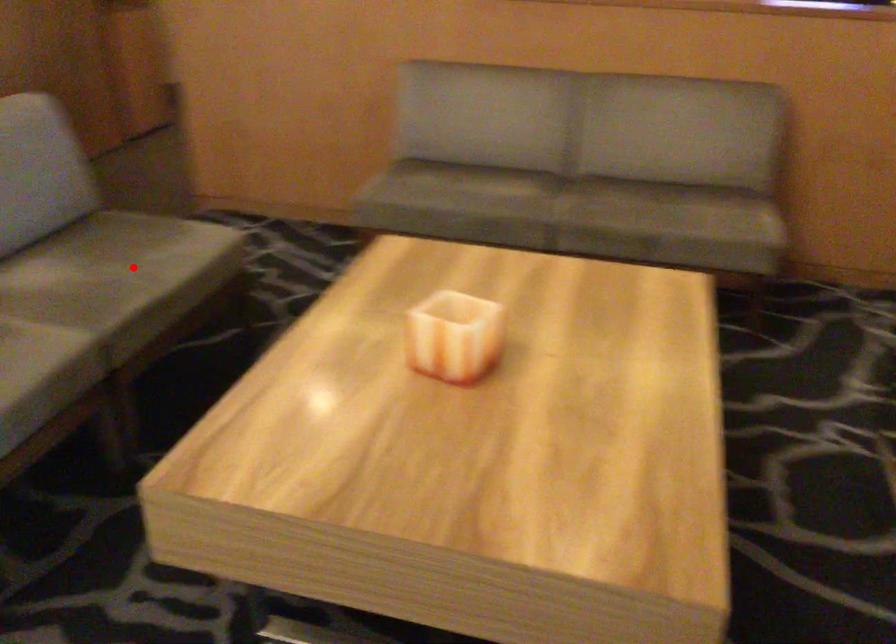
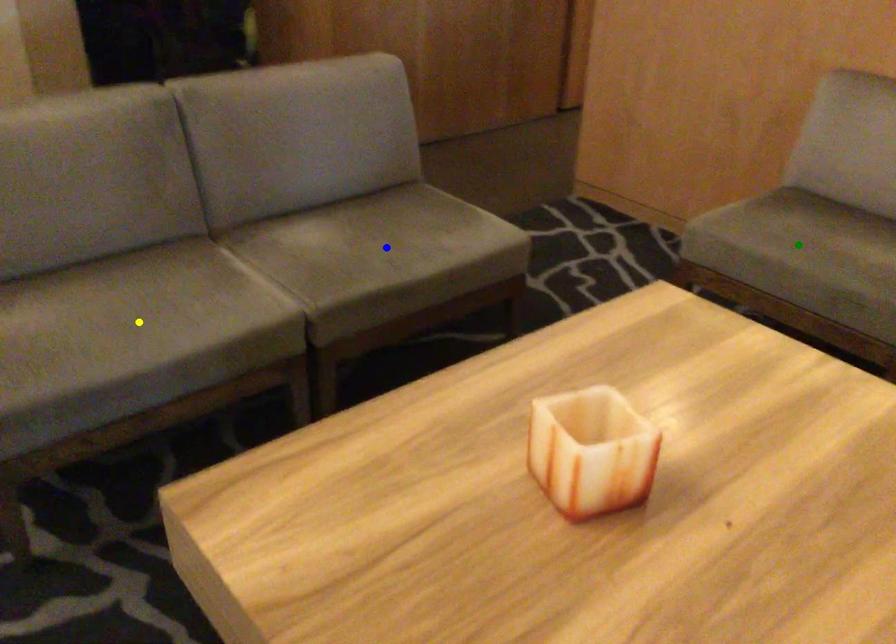
Question: I am providing you with two images of the same scene from different viewpoints. A red point is marked on the first image. You are given multiple points on the second image. Which point in image 2 is actually the same real-world point as the red point in image 1?

Choices:
 (A) green point
 (B) blue point
 (C) yellow point

Answer: (B)